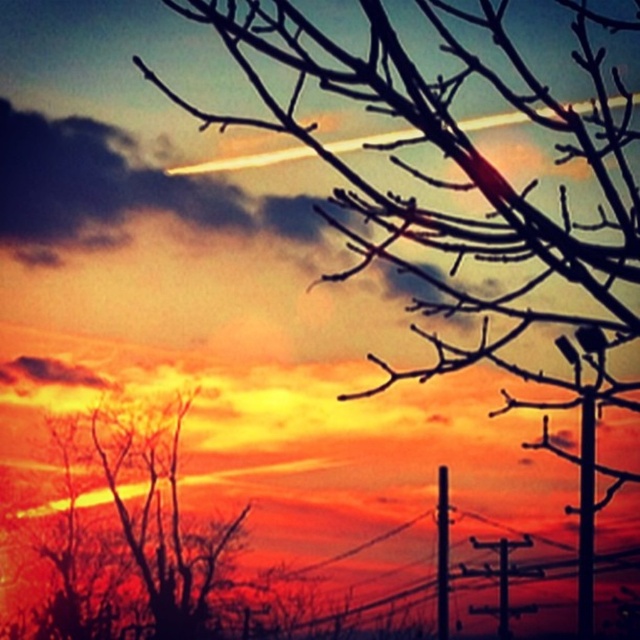
Is metallic gray telegraph pole at center positioned at the back of metallic gray telegraph pole at lower right?

Yes, it is behind metallic gray telegraph pole at lower right.

Is metallic gray telegraph pole at center closer to camera compared to metallic gray telegraph pole at lower right?

No, metallic gray telegraph pole at center is further to the viewer.

Is point (444, 483) positioned behind point (506, 580)?

Yes, it is.

Identify the location of metallic gray telegraph pole at center. (442, 554).

Where is `silhouette bare tree at left`? The image size is (640, 640). silhouette bare tree at left is located at coordinates (140, 540).

Between silhouette bare tree at left and metallic gray telegraph pole at lower right, which one is positioned lower?

metallic gray telegraph pole at lower right is below.

Is point (150, 541) less distant than point (506, 584)?

No, it is behind (506, 584).

Where is `silhouette bare tree at left`? The image size is (640, 640). silhouette bare tree at left is located at coordinates (140, 540).

Who is higher up, smooth metallic pole at center right or metallic gray telegraph pole at lower right?

smooth metallic pole at center right is higher up.

Who is more forward, (584, 572) or (500, 602)?

Point (584, 572) is in front.

The width and height of the screenshot is (640, 640). Identify the location of smooth metallic pole at center right. (586, 516).